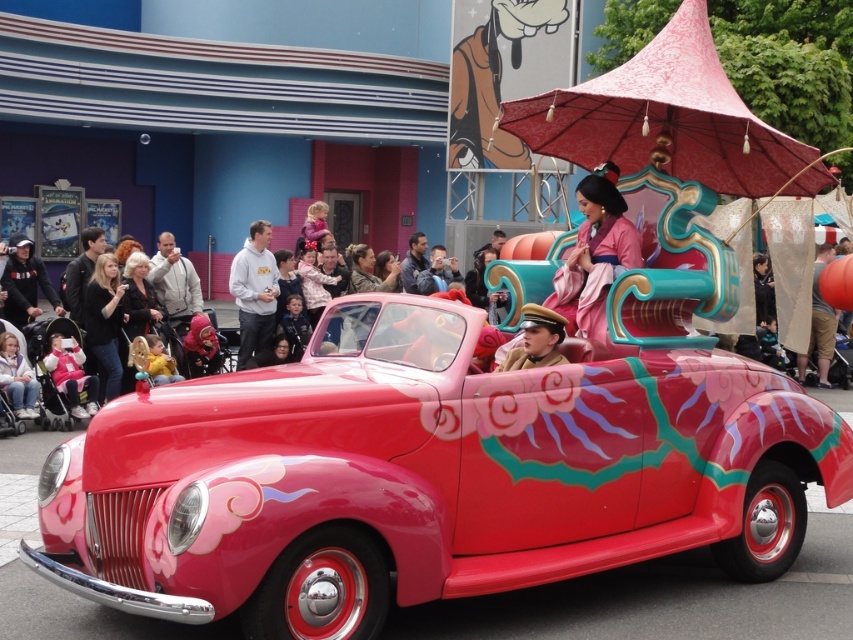
Question: Is glossy metallic car at center positioned before white fleece jacket at lower left?

Choices:
 (A) yes
 (B) no

Answer: (A)

Question: Can you confirm if pink satin kimono at upper center is thinner than pink fabric stroller at lower left?

Choices:
 (A) no
 (B) yes

Answer: (A)

Question: Estimate the real-world distances between objects in this image. Which object is closer to the black leather jacket at left?

Choices:
 (A) matte gold helmet at center
 (B) pink fabric stroller at lower left
 (C) glossy metallic car at center

Answer: (B)

Question: Is matte gold helmet at center further to the viewer compared to white fleece jacket at lower left?

Choices:
 (A) no
 (B) yes

Answer: (A)

Question: Based on their relative distances, which object is farther from the glossy metallic car at center?

Choices:
 (A) white fleece jacket at lower left
 (B) matte gold helmet at center
 (C) gray hoodie at center

Answer: (C)

Question: Which point is farther to the camera?

Choices:
 (A) (524, 317)
 (B) (270, 227)

Answer: (B)